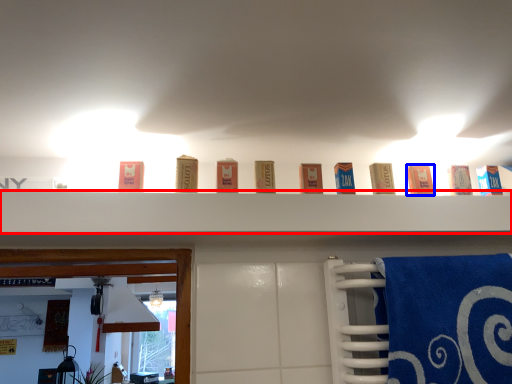
Question: Which of the following is the closest to the observer, shelf (highlighted by a red box) or product (highlighted by a blue box)?

Choices:
 (A) shelf
 (B) product

Answer: (A)